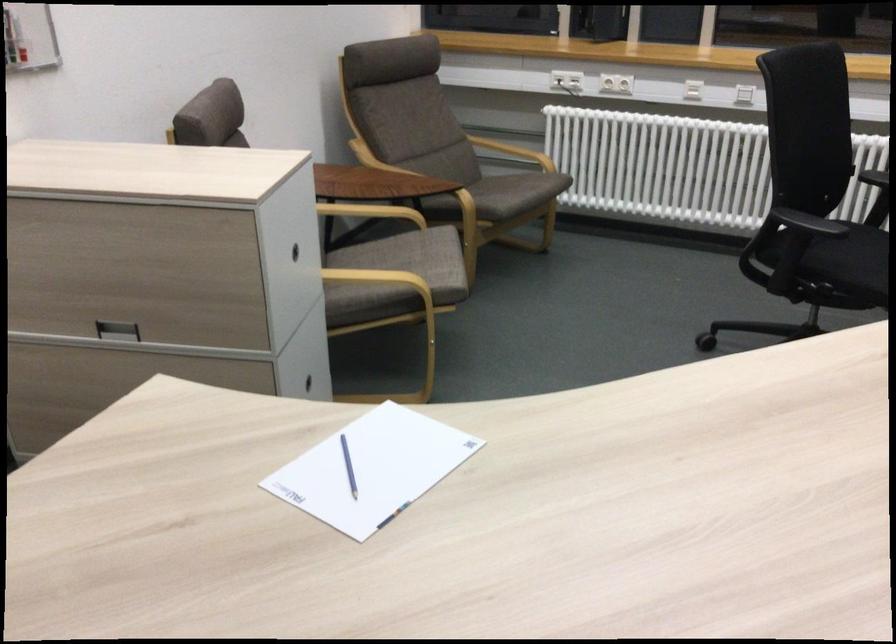
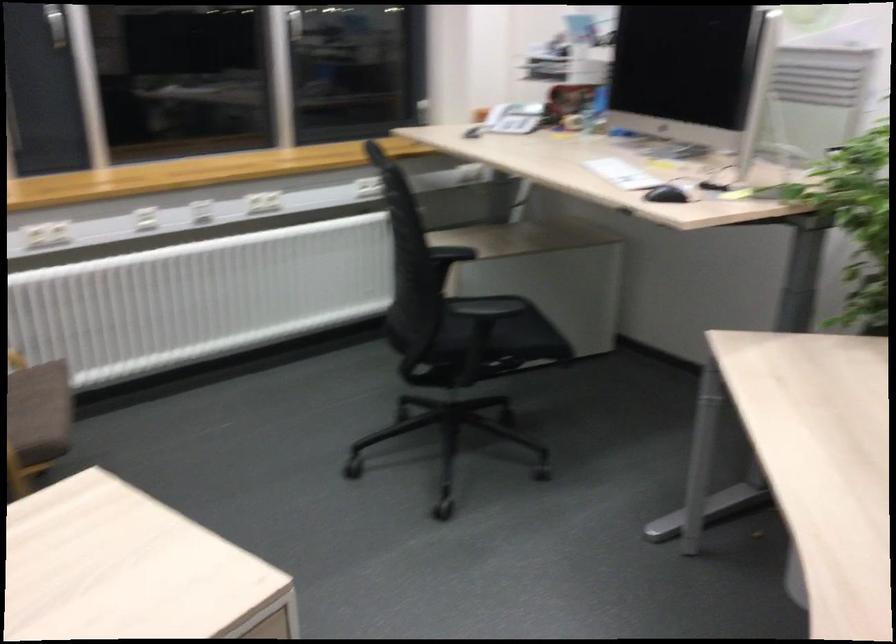
Question: I am providing you with two images of the same scene from different viewpoints. After the viewpoint changes to image2, which objects are now occluded?

Choices:
 (A) silver bowl
 (B) black computer mouse
 (C) white telephone handset
 (D) brown chair sitting surface

Answer: (D)